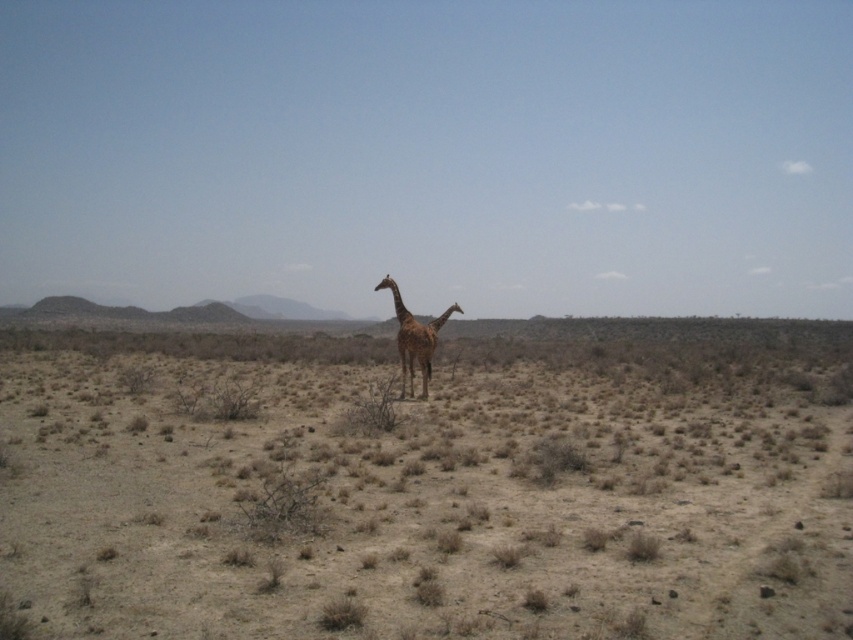
Which is more to the left, brown dry grass at center or glossy brown giraffe at center?

glossy brown giraffe at center

Measure the distance between point (811, 540) and camera.

Point (811, 540) and camera are 7.80 meters apart.

Who is more distant from viewer, (323, 593) or (403, 358)?

Positioned behind is point (403, 358).

Where is `brown dry grass at center`? This screenshot has width=853, height=640. brown dry grass at center is located at coordinates (430, 484).